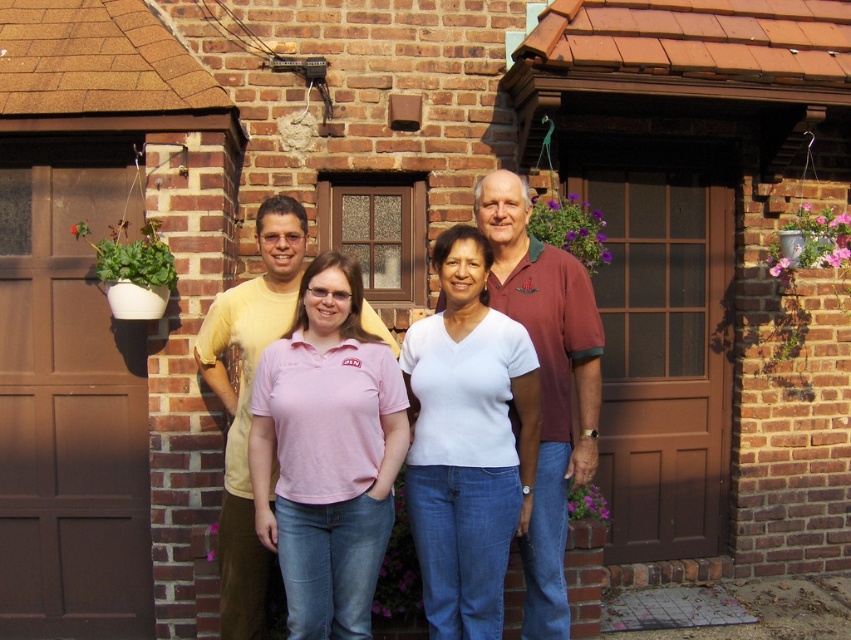
Is pink cotton polo shirt at center to the right of pink cotton shirt at center from the viewer's perspective?

Incorrect, pink cotton polo shirt at center is not on the right side of pink cotton shirt at center.

Does pink cotton polo shirt at center appear under pink cotton shirt at center?

Correct, pink cotton polo shirt at center is located below pink cotton shirt at center.

Where is `pink cotton polo shirt at center`? pink cotton polo shirt at center is located at coordinates (327, 452).

Can you confirm if pink cotton polo shirt at center is shorter than white matte shirt at center?

Correct, pink cotton polo shirt at center is not as tall as white matte shirt at center.

Which is behind, point (398, 460) or point (458, 452)?

Point (458, 452)

Locate an element on the screen. This screenshot has width=851, height=640. pink cotton polo shirt at center is located at coordinates (327, 452).

Locate an element on the screen. Image resolution: width=851 pixels, height=640 pixels. pink cotton polo shirt at center is located at coordinates (327, 452).

Which is above, white matte shirt at center or pink cotton shirt at center?

pink cotton shirt at center is above.

Who is more distant from viewer, [464,512] or [589,292]?

Positioned behind is point [589,292].

Where is `white matte shirt at center`? This screenshot has height=640, width=851. white matte shirt at center is located at coordinates (467, 442).